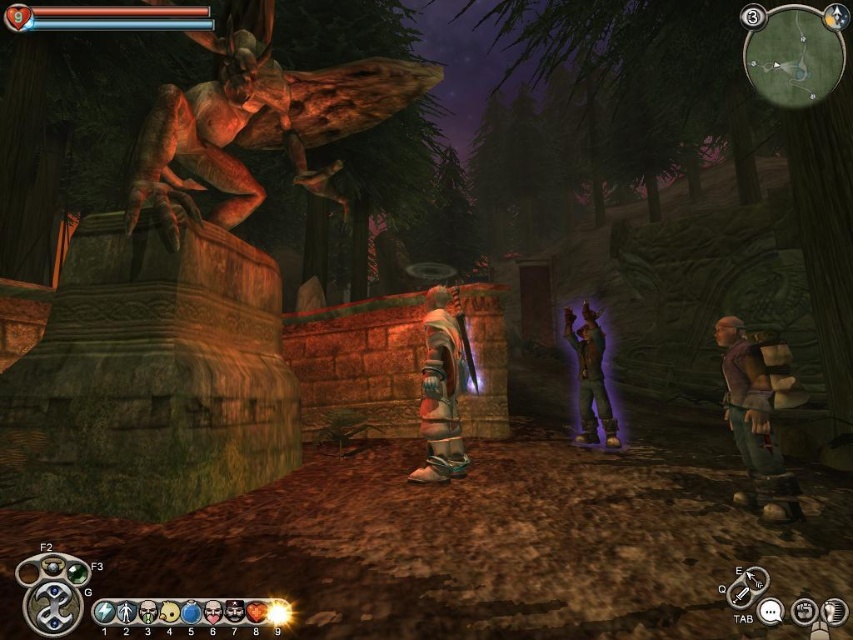
Question: Is purple fabric backpack at lower right below leather jacket at center?

Choices:
 (A) yes
 (B) no

Answer: (B)

Question: Which of the following is the closest to the observer?

Choices:
 (A) (749, 369)
 (B) (607, 426)
 (C) (462, 342)

Answer: (A)

Question: Can you confirm if purple fabric backpack at lower right is positioned to the left of shiny silver armor at center?

Choices:
 (A) no
 (B) yes

Answer: (A)

Question: Where is purple fabric backpack at lower right located in relation to shiny silver armor at center in the image?

Choices:
 (A) below
 (B) above

Answer: (B)

Question: Estimate the real-world distances between objects in this image. Which object is closer to the purple fabric backpack at lower right?

Choices:
 (A) shiny silver armor at center
 (B) leather jacket at center

Answer: (A)

Question: Which object is farther from the camera taking this photo?

Choices:
 (A) leather jacket at center
 (B) purple fabric backpack at lower right
 (C) shiny silver armor at center

Answer: (A)